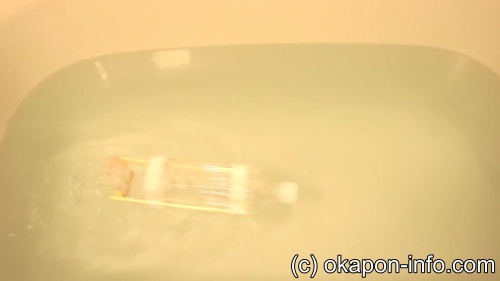
Find the location of a particular element. light is located at coordinates (102, 78).